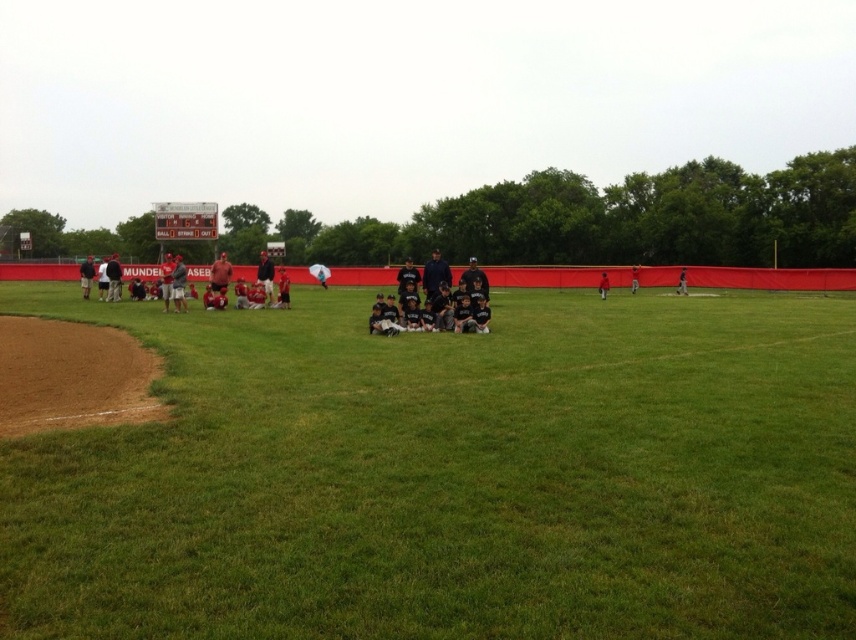
Question: Is green grass at center positioned behind matte red baseball caps at center?

Choices:
 (A) yes
 (B) no

Answer: (B)

Question: Considering the real-world distances, which object is closest to the black jersey baseball team at center?

Choices:
 (A) matte red baseball caps at center
 (B) blue fabric jacket at center

Answer: (B)

Question: Which point is farther to the camera?

Choices:
 (A) green grass at center
 (B) blue fabric jacket at center

Answer: (B)

Question: Estimate the real-world distances between objects in this image. Which object is farther from the green grass at center?

Choices:
 (A) black jersey baseball team at center
 (B) matte red baseball caps at center

Answer: (B)

Question: Does matte red baseball caps at center appear on the left side of black jersey baseball team at center?

Choices:
 (A) no
 (B) yes

Answer: (B)

Question: Can you confirm if green grass at center is smaller than matte red baseball caps at center?

Choices:
 (A) no
 (B) yes

Answer: (B)